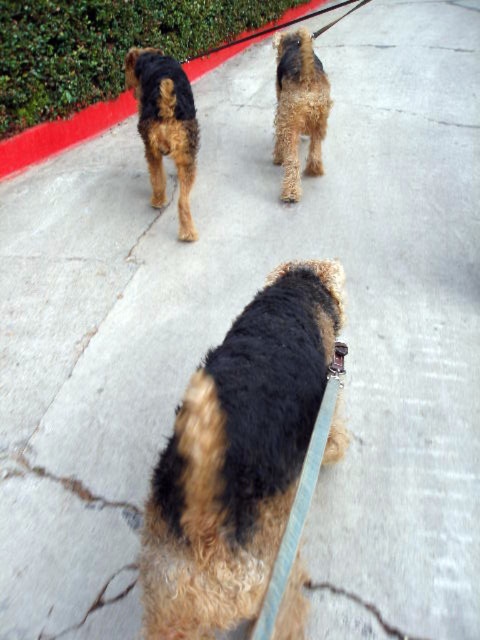
Who is higher up, golden-brown fur dog at upper left or golden-brown fur at center?

golden-brown fur at center is above.

Is golden-brown fur dog at upper left closer to the viewer compared to golden-brown fur at center?

Yes, golden-brown fur dog at upper left is in front of golden-brown fur at center.

The height and width of the screenshot is (640, 480). I want to click on golden-brown fur dog at upper left, so click(165, 125).

Between golden-brown fur dog at center and golden-brown fur at center, which one appears on the right side from the viewer's perspective?

Positioned to the right is golden-brown fur at center.

Is golden-brown fur dog at center taller than golden-brown fur at center?

In fact, golden-brown fur dog at center may be shorter than golden-brown fur at center.

Is point (297, 387) closer to viewer compared to point (291, 148)?

Yes, it is in front of point (291, 148).

Identify the location of golden-brown fur dog at center. (238, 456).

Can you confirm if golden-brown fur dog at center is thinner than golden-brown fur dog at upper left?

Incorrect, golden-brown fur dog at center's width is not less than golden-brown fur dog at upper left's.

Is golden-brown fur dog at center smaller than golden-brown fur dog at upper left?

Correct, golden-brown fur dog at center occupies less space than golden-brown fur dog at upper left.

The height and width of the screenshot is (640, 480). I want to click on golden-brown fur dog at center, so click(x=238, y=456).